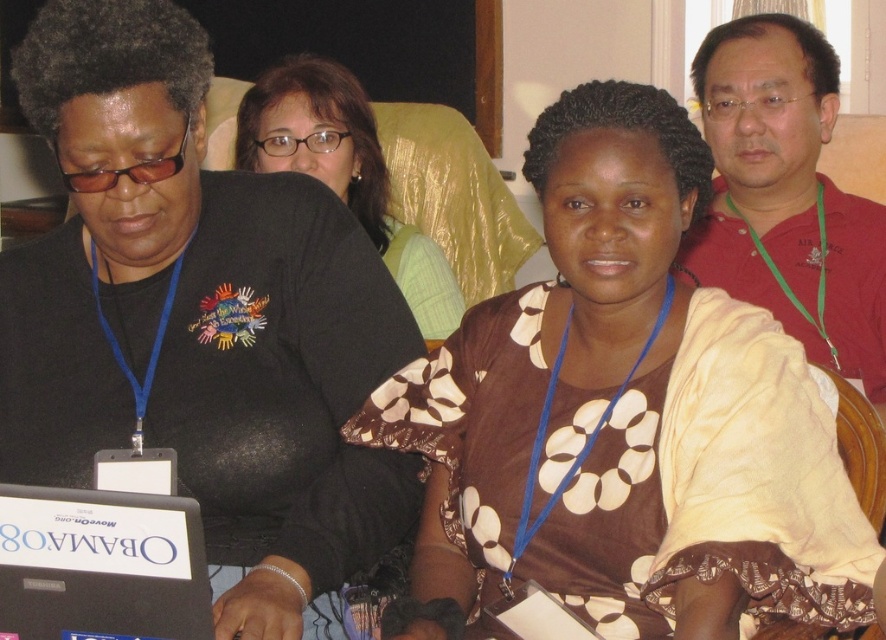
Question: Estimate the real-world distances between objects in this image. Which object is farther from the black plastic laptop at lower left?

Choices:
 (A) brown dotted blouse at center
 (B) brown textured blouse at center

Answer: (B)

Question: Which object is positioned farthest from the brown textured blouse at center?

Choices:
 (A) black plastic laptop at lower left
 (B) brown dotted blouse at center
 (C) red shirt at upper right

Answer: (A)

Question: Where is red shirt at upper right located in relation to black plastic laptop at lower left in the image?

Choices:
 (A) left
 (B) right

Answer: (B)

Question: Which point appears closest to the camera in this image?

Choices:
 (A) (758, 330)
 (B) (447, 310)
 (C) (860, 260)
 (D) (10, 605)

Answer: (D)

Question: Observing the image, what is the correct spatial positioning of red shirt at upper right in reference to black plastic laptop at lower left?

Choices:
 (A) above
 (B) below

Answer: (A)

Question: Is brown dotted blouse at center further to the viewer compared to red shirt at upper right?

Choices:
 (A) yes
 (B) no

Answer: (B)